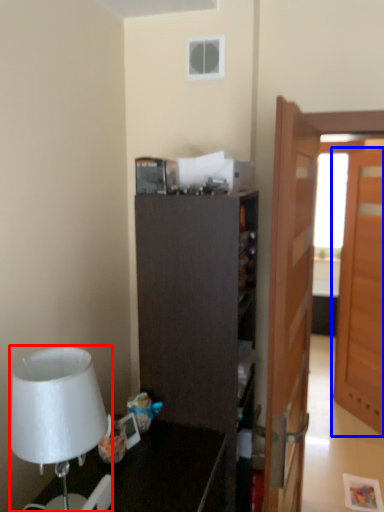
Question: Among these objects, which one is nearest to the camera, lamp (highlighted by a red box) or door (highlighted by a blue box)?

Choices:
 (A) lamp
 (B) door

Answer: (A)